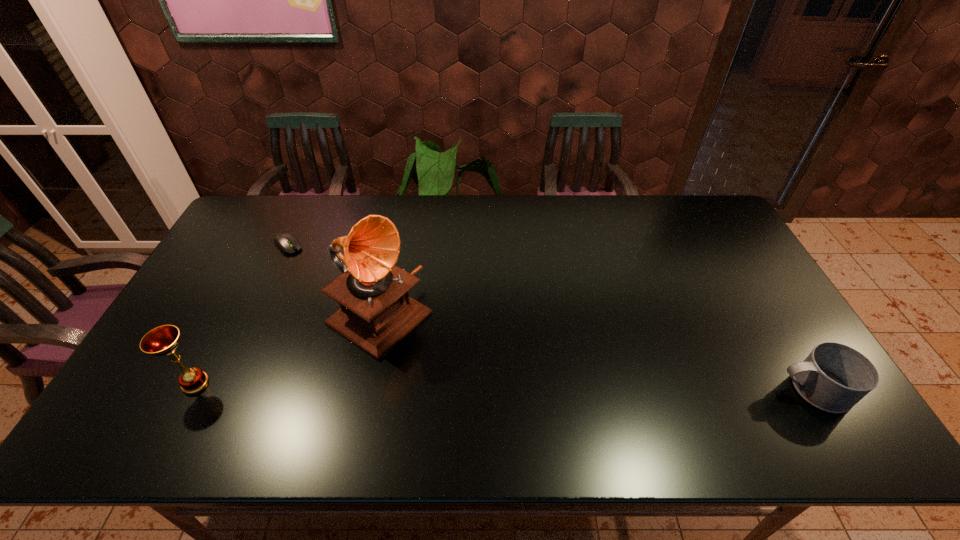
The height and width of the screenshot is (540, 960). Identify the location of free spot on the desktop that is between the chalice and the rightmost object and is positioned on the horn of the second object from right to left. (486, 386).

At what (x,y) coordinates should I click in order to perform the action: click on free spot on the desktop that is between the third shortest object and the rightmost object and is positioned on the wheel side of the farthest object. Please return your answer as a coordinate pair (x, y). The image size is (960, 540). Looking at the image, I should click on (458, 386).